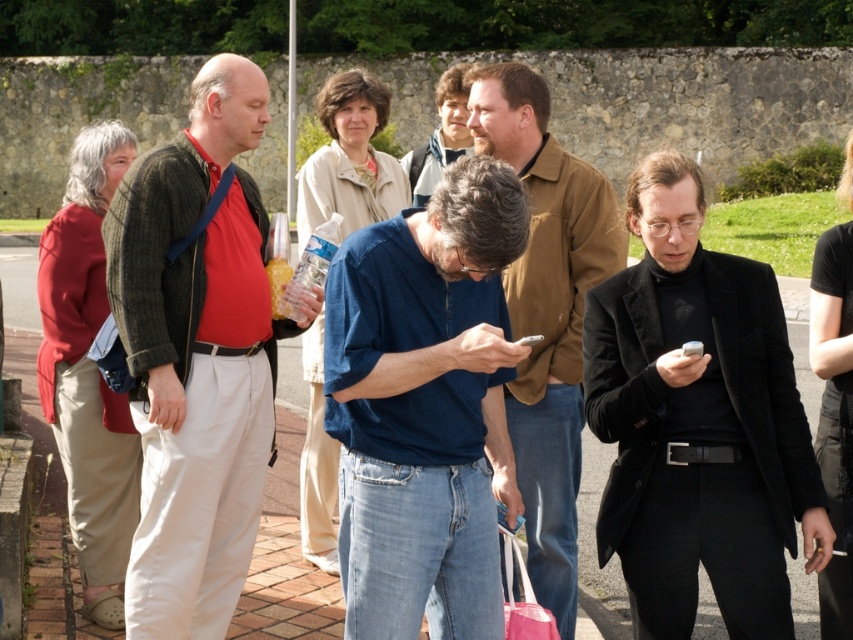
You are trying to locate the black wool coat at center and the denim jeans at center in the image. According to the description, which object is positioned to the right of the other?

The black wool coat at center is to the right of the denim jeans at center.

You are a photographer trying to capture both the denim jeans at center and the pink fabric shopping bag at lower center in a single frame. Based on their positions, which object should you focus on first to ensure both are in the shot?

The denim jeans at center is located above the pink fabric shopping bag at lower center, so you should focus on the denim jeans at center first to ensure both are in the shot.

You are a photographer trying to capture a candid shot of the black wool coat at center and the denim jeans at center. Since you want to focus on the coat, should you adjust your camera to focus on the foreground or background?

The black wool coat at center is in front of the denim jeans at center, so to focus on the coat, adjust your camera to focus on the foreground.